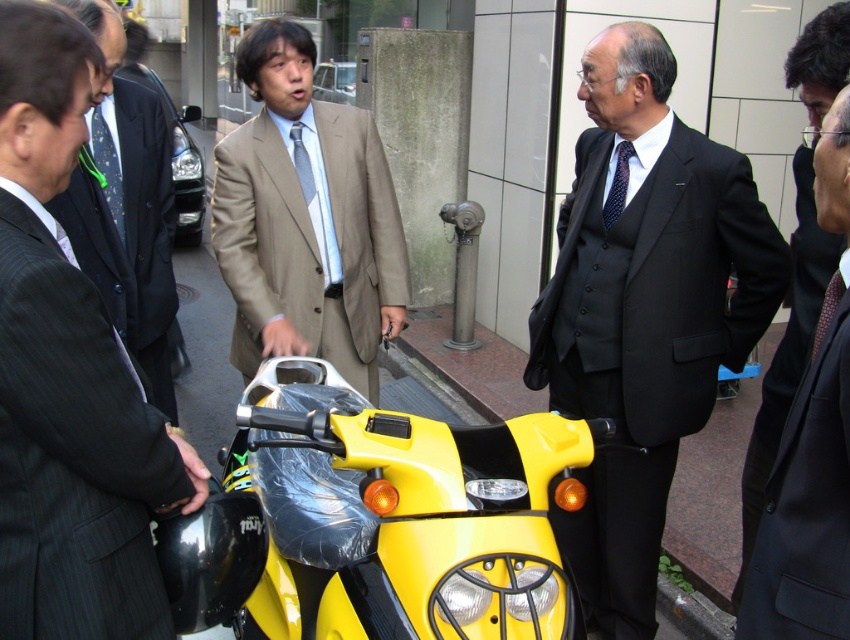
Does black suit at center appear on the left side of matte black suit at left?

Incorrect, black suit at center is not on the left side of matte black suit at left.

Is black suit at center bigger than matte black suit at left?

Yes, black suit at center is bigger than matte black suit at left.

Between point (570, 268) and point (143, 128), which one is positioned behind?

Point (570, 268)

This screenshot has width=850, height=640. In order to click on black suit at center in this screenshot , I will do `click(644, 310)`.

Is yellow glossy motorcycle at center bigger than matte gray suit at center?

Correct, yellow glossy motorcycle at center is larger in size than matte gray suit at center.

Does yellow glossy motorcycle at center appear under matte gray suit at center?

Correct, yellow glossy motorcycle at center is located below matte gray suit at center.

Between point (261, 364) and point (3, 595), which one is positioned in front?

Point (3, 595) is in front.

The width and height of the screenshot is (850, 640). In order to click on yellow glossy motorcycle at center in this screenshot , I will do `click(378, 522)`.

Which is behind, point (327, 397) or point (163, 308)?

Positioned behind is point (163, 308).

Does point (486, 580) lie behind point (55, 205)?

No, it is in front of (55, 205).

Is point (273, 440) in front of point (106, 134)?

Yes, it is in front of point (106, 134).

Identify the location of yellow glossy motorcycle at center. (378, 522).